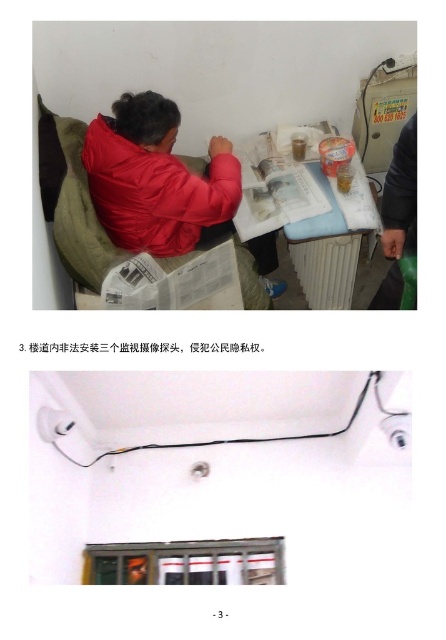
Which of these two, white plastic table at upper center or white glossy paper at center, stands shorter?

With less height is white glossy paper at center.

Measure the distance between white plastic table at upper center and camera.

white plastic table at upper center is 1.70 meters away from camera.

This screenshot has width=446, height=640. I want to click on white plastic table at upper center, so click(326, 241).

What do you see at coordinates (155, 193) in the screenshot? The width and height of the screenshot is (446, 640). I see `matte red jacket at center` at bounding box center [155, 193].

Does matte red jacket at center come behind matte black jacket at upper left?

Yes, it is behind matte black jacket at upper left.

Identify the location of matte red jacket at center. This screenshot has width=446, height=640. (155, 193).

Where is `matte red jacket at center`? This screenshot has width=446, height=640. matte red jacket at center is located at coordinates coord(155,193).

Is point (223, 301) more distant than point (404, 148)?

That is True.

Is point (205, 284) positioned after point (409, 188)?

Yes, point (205, 284) is farther from viewer.

This screenshot has height=640, width=446. Identify the location of white glossy paper at center. (176, 282).